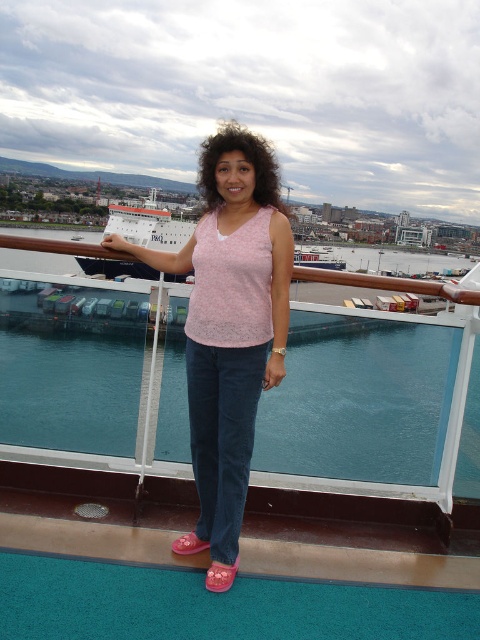
Question: Does pink fabric tank top at center appear under white glossy cruise ship at upper left?

Choices:
 (A) yes
 (B) no

Answer: (A)

Question: Which object is farther from the camera taking this photo?

Choices:
 (A) blue water at center
 (B) pink fabric tank top at center
 (C) white glossy cruise ship at upper left

Answer: (C)

Question: Which object appears closest to the camera in this image?

Choices:
 (A) blue water at center
 (B) pink fabric tank top at center

Answer: (B)

Question: Which object is closer to the camera taking this photo?

Choices:
 (A) blue water at center
 (B) pink fabric tank top at center

Answer: (B)

Question: Can you confirm if blue water at center is positioned above white glossy cruise ship at upper left?

Choices:
 (A) no
 (B) yes

Answer: (A)

Question: Is blue water at center smaller than pink fabric tank top at center?

Choices:
 (A) yes
 (B) no

Answer: (A)